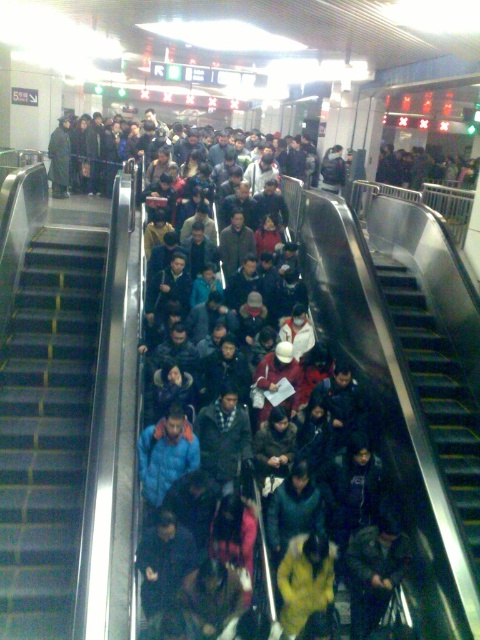
You are standing at the entrance of the subway station and see a person wearing a dark blue jacket at center. Can you determine if the point at coordinates (356, 321) is located on the dark blue jacket at center?

Yes, the point at coordinates (356, 321) is located on the dark blue jacket at center according to the description.

You are standing in a busy subway station and want to reach a specific point marked as point [333,244]. Given that you can walk 1.5 meters per second, how long will it take you to reach that point?

The point [333,244] is 8.66 meters away from the viewer. At a walking speed of 1.5 meters per second, it will take approximately 5.77 seconds to reach the point.